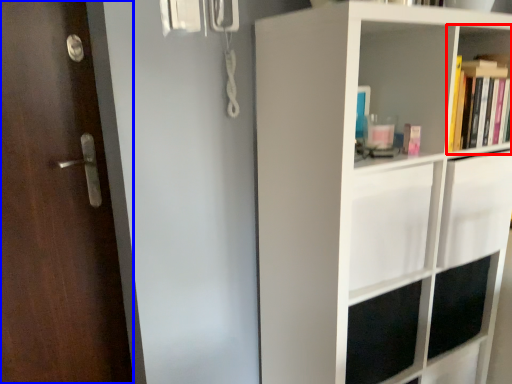
Question: Among these objects, which one is farthest to the camera, shelf (highlighted by a red box) or door (highlighted by a blue box)?

Choices:
 (A) shelf
 (B) door

Answer: (A)